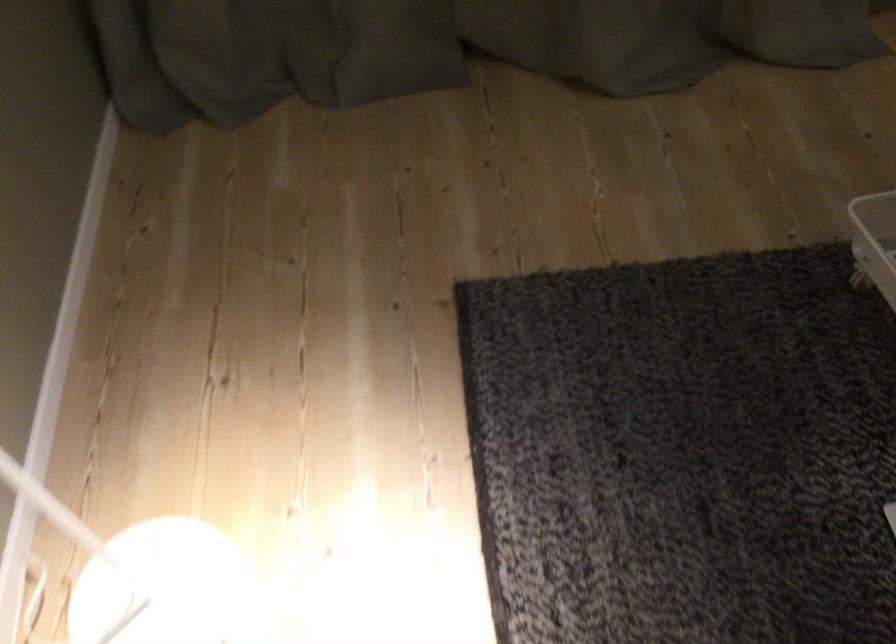
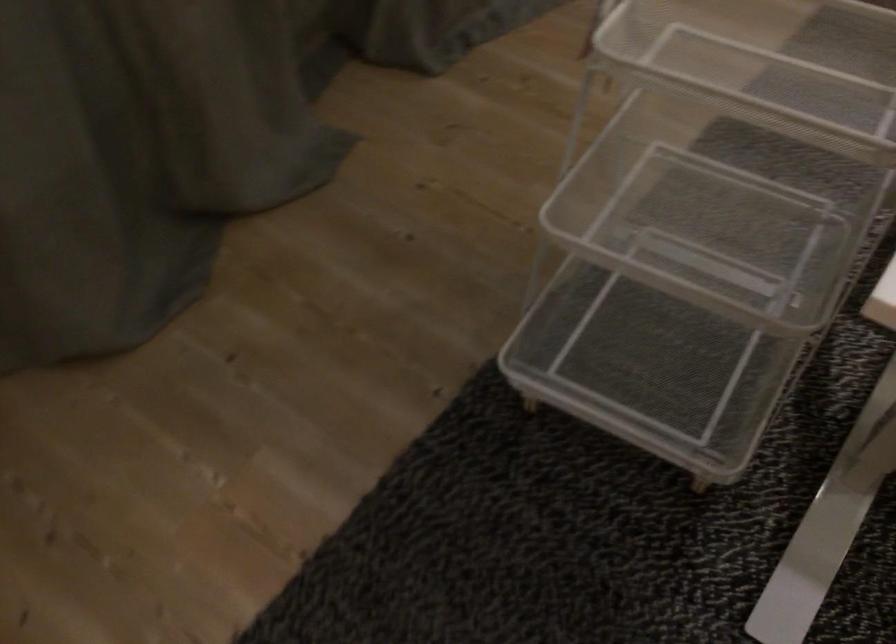
Question: The images are taken continuously from a first-person perspective. In which direction is your viewpoint rotating?

Choices:
 (A) Left
 (B) Right
 (C) Up
 (D) Down

Answer: (B)